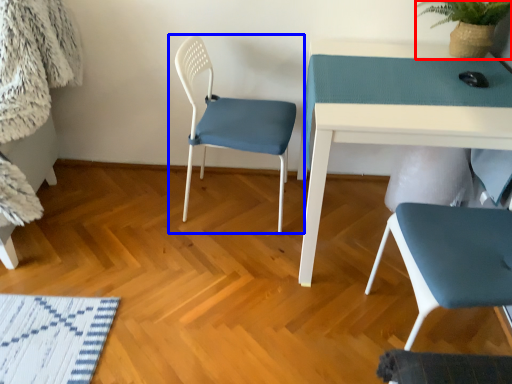
Question: Which of the following is the farthest to the observer, plant (highlighted by a red box) or chair (highlighted by a blue box)?

Choices:
 (A) plant
 (B) chair

Answer: (A)